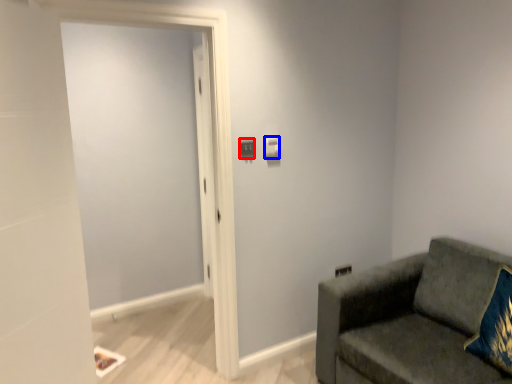
Question: Among these objects, which one is farthest to the camera, light switch (highlighted by a red box) or light switch (highlighted by a blue box)?

Choices:
 (A) light switch
 (B) light switch

Answer: (B)